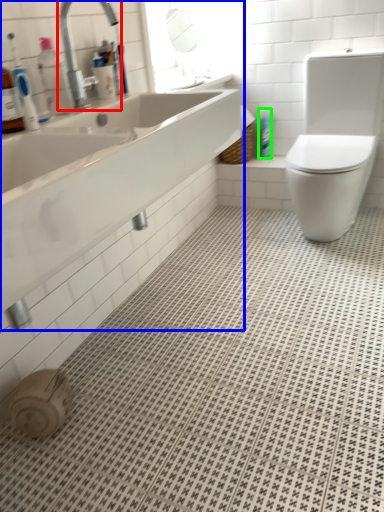
Question: Based on their relative distances, which object is nearer to tap (highlighted by a red box)? Choose from sink (highlighted by a blue box) and toiletry (highlighted by a green box).

Choices:
 (A) sink
 (B) toiletry

Answer: (A)